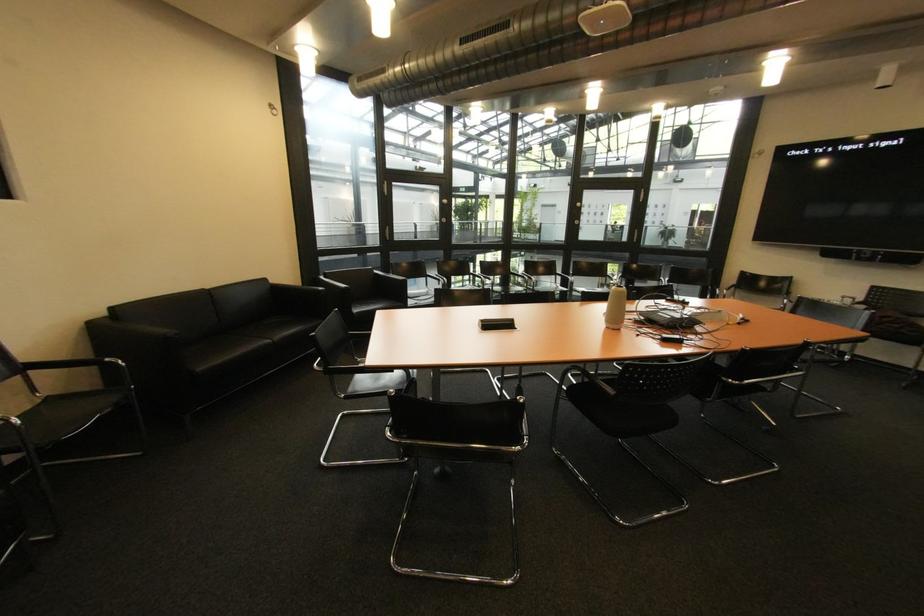
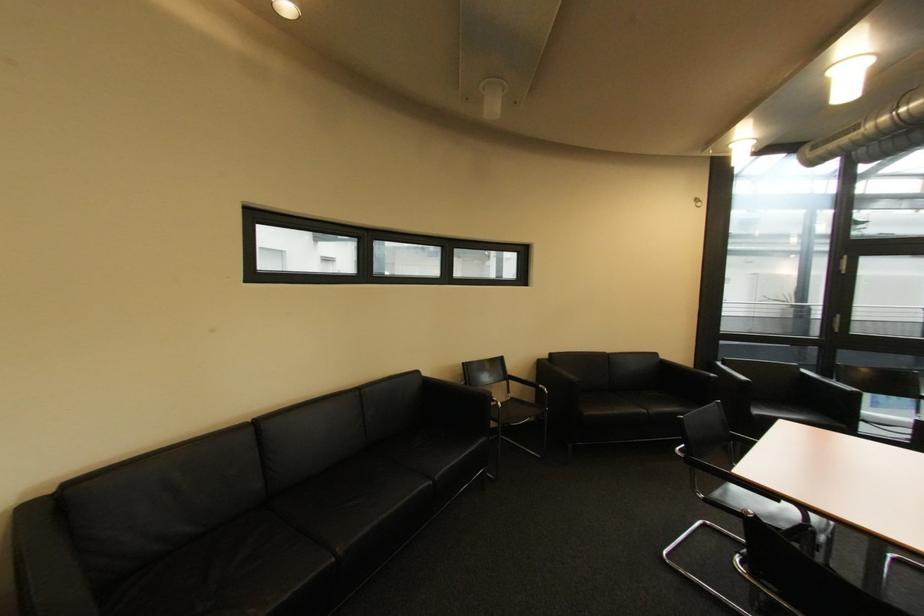
The point at (283, 341) is marked in the first image. Where is the corresponding point in the second image?

(658, 413)